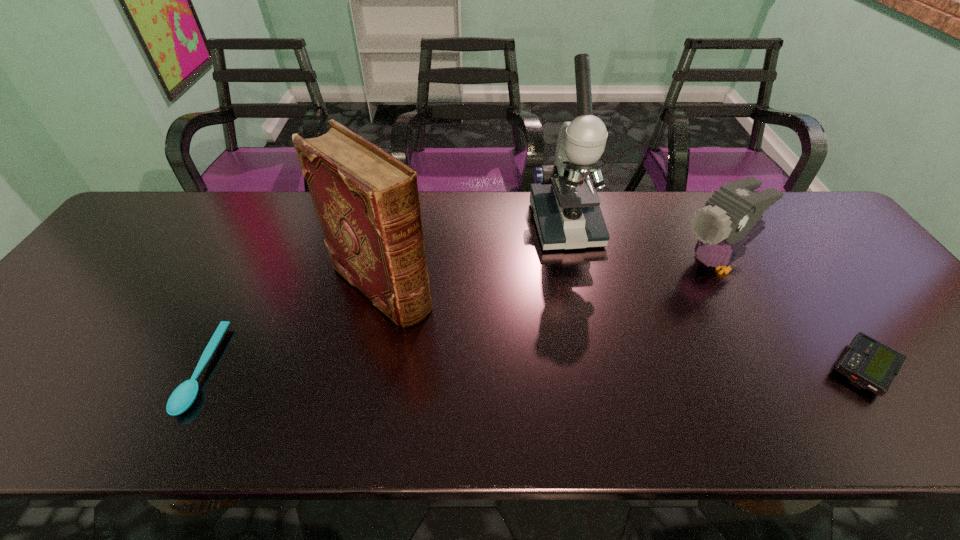
Where is `bird positioned at the far edge`? This screenshot has height=540, width=960. bird positioned at the far edge is located at coordinates (734, 212).

I want to click on microscope located in the far edge section of the desktop, so (x=564, y=201).

The height and width of the screenshot is (540, 960). In order to click on spoon positioned at the near edge in this screenshot , I will do `click(184, 395)`.

Identify the location of beeper at the near edge. The image size is (960, 540). (867, 363).

At what (x,y) coordinates should I click in order to perform the action: click on object that is positioned at the right edge. Please return your answer as a coordinate pair (x, y). The image size is (960, 540). Looking at the image, I should click on (867, 363).

Where is `object positioned at the near right corner`? object positioned at the near right corner is located at coordinates click(x=867, y=363).

The width and height of the screenshot is (960, 540). I want to click on vacant space at the far edge of the desktop, so 225,219.

In the image, there is a desktop. At what (x,y) coordinates should I click in order to perform the action: click on vacant space at the near edge. Please return your answer as a coordinate pair (x, y). Looking at the image, I should click on (431, 386).

The width and height of the screenshot is (960, 540). In order to click on vacant space at the left edge in this screenshot , I will do `click(77, 299)`.

In the image, there is a desktop. Identify the location of free space at the right edge. The width and height of the screenshot is (960, 540). (864, 259).